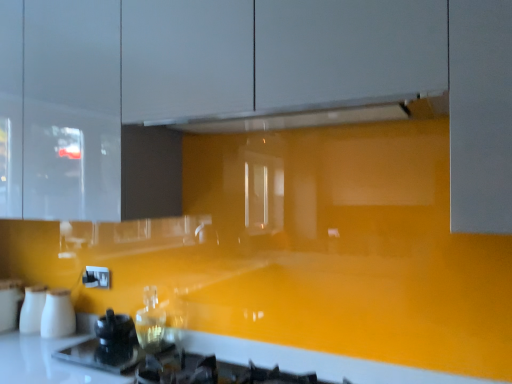
Question: From a real-world perspective, is white glossy salt and pepper shakers at lower left, which appears as the 2th appliance when viewed from the left, above or below glossy yellow countertop at lower center?

Choices:
 (A) below
 (B) above

Answer: (B)

Question: In the image, is white glossy salt and pepper shakers at lower left, the third appliance viewed from the right, on the left side or the right side of glossy yellow countertop at lower center?

Choices:
 (A) right
 (B) left

Answer: (B)

Question: Which object is the farthest from the white glossy salt and pepper shakers at lower left, the third appliance viewed from the right?

Choices:
 (A) black glossy kettle at lower left, positioned as the fourth appliance in left-to-right order
 (B) white glossy exhaust hood at upper center
 (C) glossy yellow countertop at lower center
 (D) white matte milk jugs at lower left, placed as the second appliance when sorted from right to left
 (E) white glossy salt and pepper shakers at left, which appears as the 1th appliance when viewed from the left

Answer: (B)

Question: Which of these objects is positioned farthest from the white matte milk jugs at lower left, placed as the third appliance when sorted from left to right?

Choices:
 (A) white glossy exhaust hood at upper center
 (B) white glossy salt and pepper shakers at left, which appears as the 1th appliance when viewed from the left
 (C) glossy yellow countertop at lower center
 (D) white glossy salt and pepper shakers at lower left, which appears as the 2th appliance when viewed from the left
 (E) black glossy kettle at lower left, positioned as the fourth appliance in left-to-right order

Answer: (A)